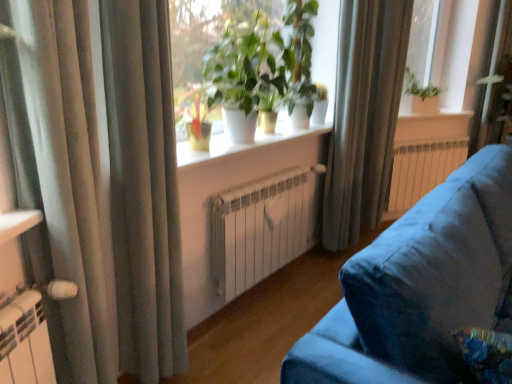
Question: Relative to silky gray curtain at left, placed as the second curtain when sorted from right to left, is white glossy pot at center in front or behind?

Choices:
 (A) front
 (B) behind

Answer: (B)

Question: From a real-world perspective, is white glossy pot at center positioned above or below silky gray curtain at left, the 2th curtain from the front?

Choices:
 (A) above
 (B) below

Answer: (A)

Question: Which of these objects is positioned farthest from the silky gray curtain at upper right, which appears as the third curtain when viewed from the front?

Choices:
 (A) silky gray curtain at left, which is the second curtain in left-to-right order
 (B) white glossy window sill at center, acting as the 2th window sill starting from the top
 (C) white glossy pot at center
 (D) white metallic radiator at center, acting as the first radiator starting from the front
 (E) velvet blue couch at lower right

Answer: (A)

Question: Which of these objects is positioned closest to the green glossy plant at upper center?

Choices:
 (A) white glossy window sill at center, the 1th window sill positioned from the front
 (B) silky gray curtain at left, placed as the second curtain when sorted from right to left
 (C) white glossy window sill at center, arranged as the 1th window sill when viewed from the right
 (D) velvet blue couch at lower right
 (E) satin fabric curtain at left, marked as the 1th curtain in a front-to-back arrangement

Answer: (A)